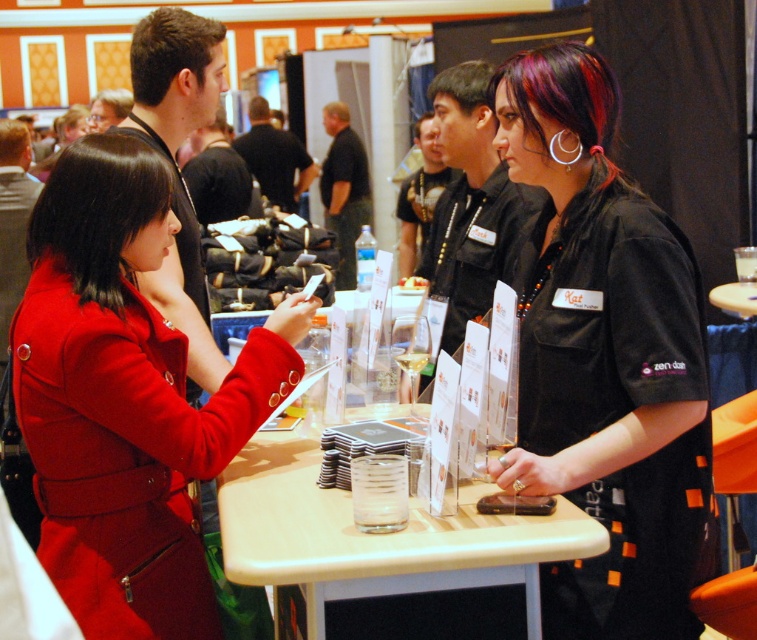
Who is higher up, brown matte hair at upper left or blonde hair at upper left?

blonde hair at upper left is higher up.

Does brown matte hair at upper left have a greater width compared to blonde hair at upper left?

Yes.

The width and height of the screenshot is (757, 640). What do you see at coordinates (170, 51) in the screenshot?
I see `brown matte hair at upper left` at bounding box center [170, 51].

Locate an element on the screen. brown matte hair at upper left is located at coordinates (170, 51).

Between point (569, 99) and point (132, 410), which one is positioned behind?

The point (569, 99) is more distant.

Does black matte shirt at center come in front of matte red coat at left?

Yes, it is in front of matte red coat at left.

Does point (597, 349) come in front of point (107, 262)?

Yes.

Identify the location of black matte shirt at center. (606, 360).

Which of these two, matte red coat at left or dark brown hair at center, stands taller?

matte red coat at left is taller.

Can you confirm if matte red coat at left is wider than dark brown hair at center?

Yes.

Locate an element on the screen. matte red coat at left is located at coordinates (125, 400).